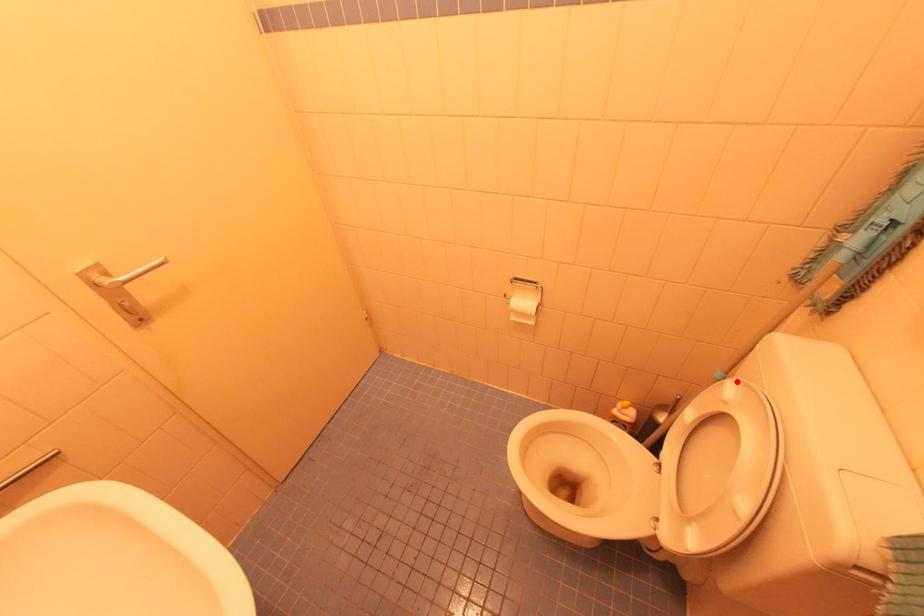
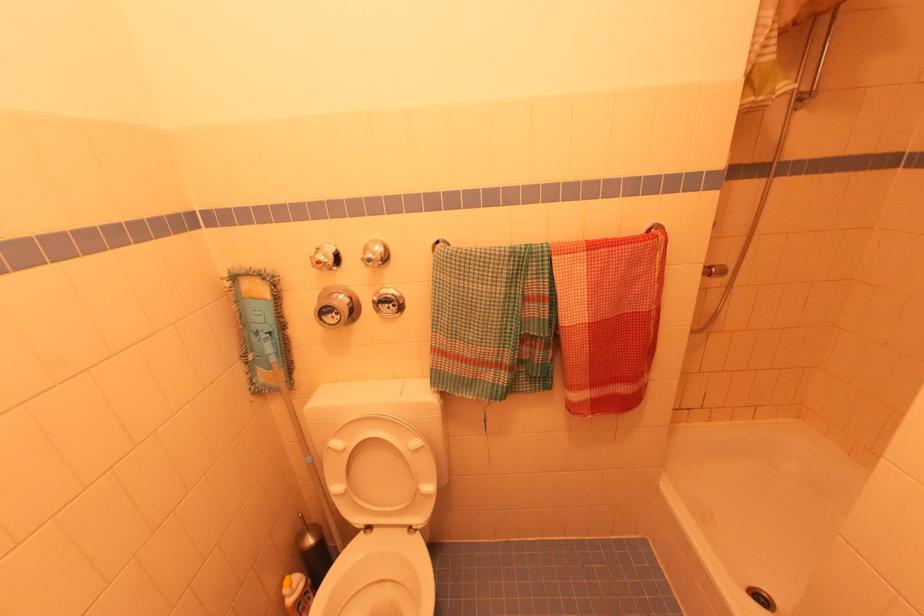
The point at the highlighted location is marked in the first image. Where is the corresponding point in the second image?

(334, 439)